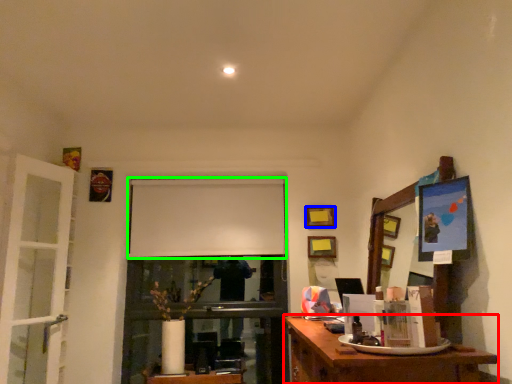
Question: Which is nearer to the desk (highlighted by a red box)? picture frame (highlighted by a blue box) or projection screen (highlighted by a green box).

Choices:
 (A) picture frame
 (B) projection screen

Answer: (B)